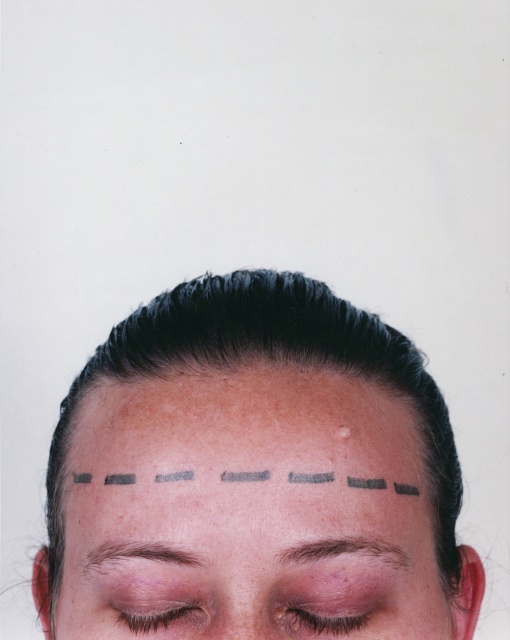
What are the coordinates of the brown hair at upper center?

The brown hair at upper center is located at point (347, 550).

You are a dermatologist examining the forehead of a patient. You notice two points on their forehead marked as point 1 at coordinate (86, 564) and point 2 at (285, 550). Based on the image, which point is closer to the camera?

Point 1 at coordinate (86, 564) is closer to the camera than point 2 at (285, 550) because the Objects Description states that point (86, 564) is further to the camera than point (285, 550). Wait, there seems to be a contradiction here. Let me check again. The Objects Description says point (86, 564) is further to the camera than point (285, 550). That means point (285, 550) is closer to the camera. Therefore, the correct answer is point 2 at (285, 550) is closer to the camera.